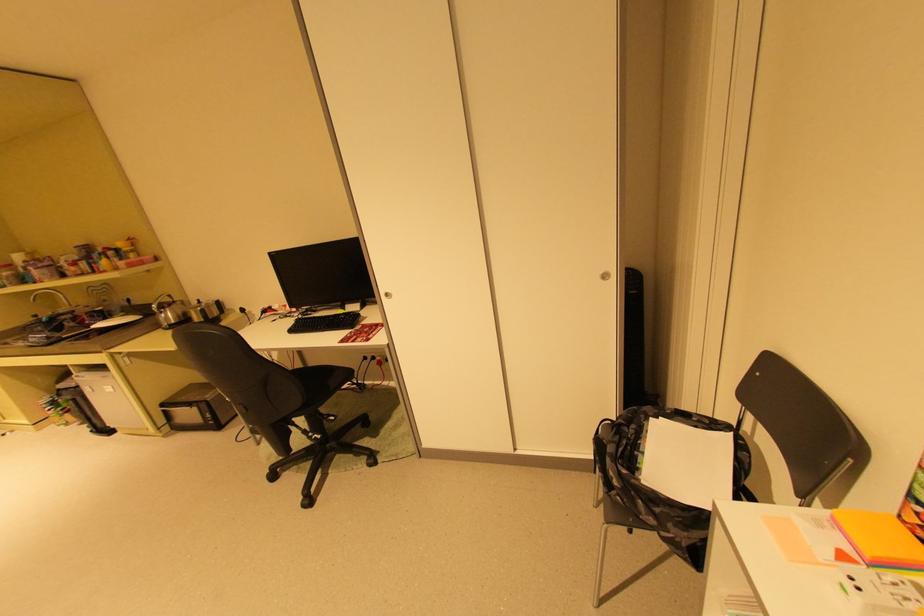
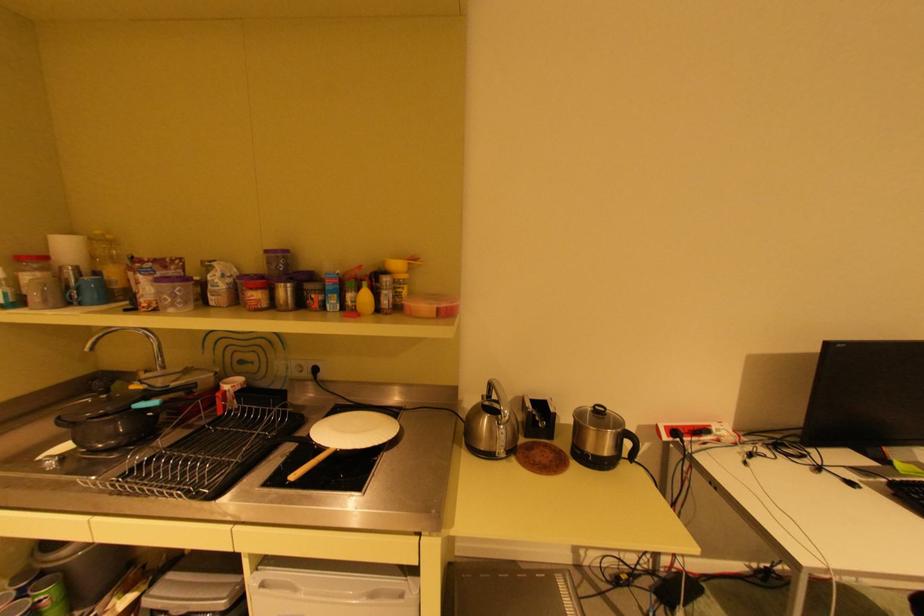
Locate, in the second image, the point that corresponds to the point at 81,269 in the first image.

(264, 294)